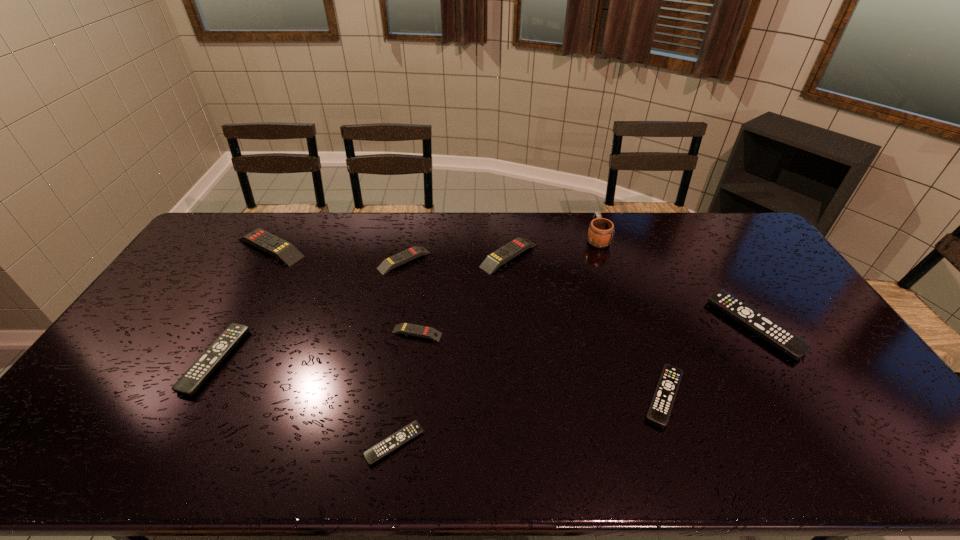
The height and width of the screenshot is (540, 960). I want to click on unoccupied position between the rightmost remote control and the tallest object, so click(676, 282).

Where is `empty space that is in between the third biggest yellow remote control and the second biggest black remote control`? The width and height of the screenshot is (960, 540). empty space that is in between the third biggest yellow remote control and the second biggest black remote control is located at coordinates (310, 310).

Where is `free space between the mug and the shortest remote control`? free space between the mug and the shortest remote control is located at coordinates (495, 341).

This screenshot has width=960, height=540. I want to click on free spot between the smallest black remote control and the third black remote control from left to right, so click(529, 420).

Select which object is the sixth closest to the tallest remote control. Please provide its 2D coordinates. Your answer should be formatted as a tuple, i.e. [(x, y)], where the tuple contains the x and y coordinates of a point satisfying the conditions above.

[(601, 231)]

The width and height of the screenshot is (960, 540). Find the location of `object identified as the closest to the second biggest yellow remote control`. object identified as the closest to the second biggest yellow remote control is located at coordinates coord(394,261).

Identify the location of remote control that can be found as the fifth closest to the leftmost black remote control. (493, 261).

Identify which remote control is the sixth closest to the smallest black remote control. Please provide its 2D coordinates. Your answer should be formatted as a tuple, i.e. [(x, y)], where the tuple contains the x and y coordinates of a point satisfying the conditions above.

[(286, 252)]

Where is `yellow remote control that is the third nearest to the leftmost yellow remote control`? The height and width of the screenshot is (540, 960). yellow remote control that is the third nearest to the leftmost yellow remote control is located at coordinates pyautogui.click(x=493, y=261).

Locate an element on the screen. The height and width of the screenshot is (540, 960). yellow remote control that can be found as the third closest to the smallest yellow remote control is located at coordinates (286, 252).